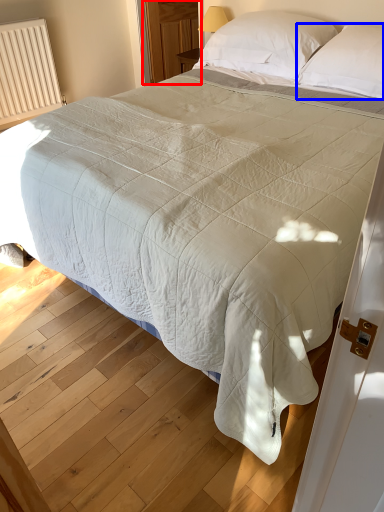
Question: Which object is further to the camera taking this photo, glass door (highlighted by a red box) or pillow (highlighted by a blue box)?

Choices:
 (A) glass door
 (B) pillow

Answer: (A)